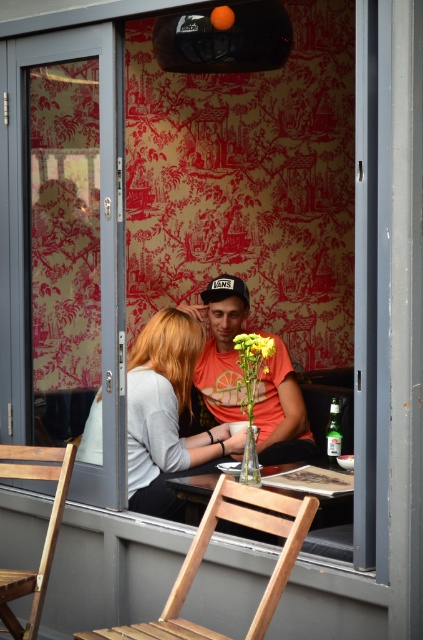
Question: Is orange matte shirt at center to the right of yellow matte flower at center from the viewer's perspective?

Choices:
 (A) yes
 (B) no

Answer: (B)

Question: Which of the following is the closest to the observer?

Choices:
 (A) (208, 529)
 (B) (175, 371)
 (C) (233, 371)

Answer: (A)

Question: Where is orange matte shirt at center located in relation to yellow matte flower at center in the image?

Choices:
 (A) right
 (B) left

Answer: (B)

Question: Estimate the real-world distances between objects in this image. Which object is farther from the matte gray sweater at center?

Choices:
 (A) transparent glass table at center
 (B) orange matte shirt at center
 (C) black fabric baseball cap at center

Answer: (C)

Question: Where is transparent glass table at center located in relation to black fabric baseball cap at center in the image?

Choices:
 (A) left
 (B) right

Answer: (B)

Question: Which object appears closest to the camera in this image?

Choices:
 (A) matte gray sweater at center
 (B) light brown wooden chair at lower center
 (C) transparent glass table at center
 (D) wooden chair at lower left

Answer: (B)